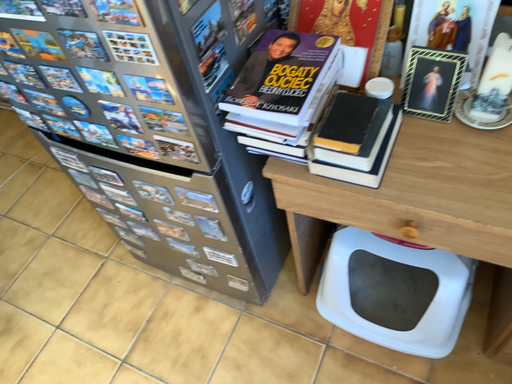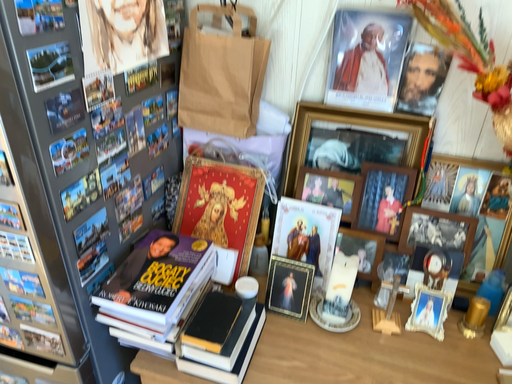
Question: Which way did the camera rotate in the video?

Choices:
 (A) rotated left
 (B) rotated right

Answer: (B)